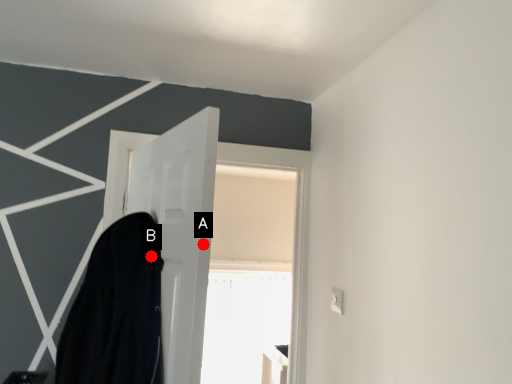
Question: Two points are circled on the image, labeled by A and B beside each circle. Which point is farther from the camera taking this photo?

Choices:
 (A) A is further
 (B) B is further

Answer: (B)